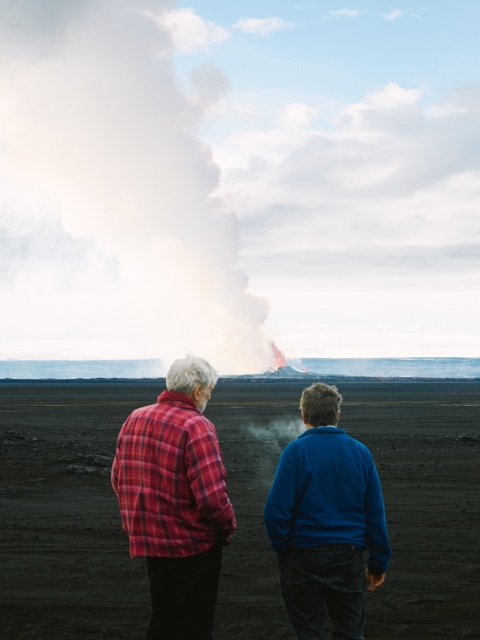
Question: Which object is farther from the camera taking this photo?

Choices:
 (A) blue fleece jacket at center
 (B) white smoke at upper center

Answer: (B)

Question: Does red plaid shirt at center appear on the left side of blue fleece jacket at center?

Choices:
 (A) yes
 (B) no

Answer: (A)

Question: Which point is farther to the camera?

Choices:
 (A) red plaid shirt at center
 (B) blue fleece jacket at center

Answer: (A)

Question: Which point is farther to the camera?

Choices:
 (A) (337, 497)
 (B) (96, 316)

Answer: (B)

Question: Is plaid fabric shirt at center behind red plaid shirt at center?

Choices:
 (A) no
 (B) yes

Answer: (A)

Question: From the image, what is the correct spatial relationship of plaid fabric shirt at center in relation to blue fleece jacket at center?

Choices:
 (A) left
 (B) right

Answer: (A)